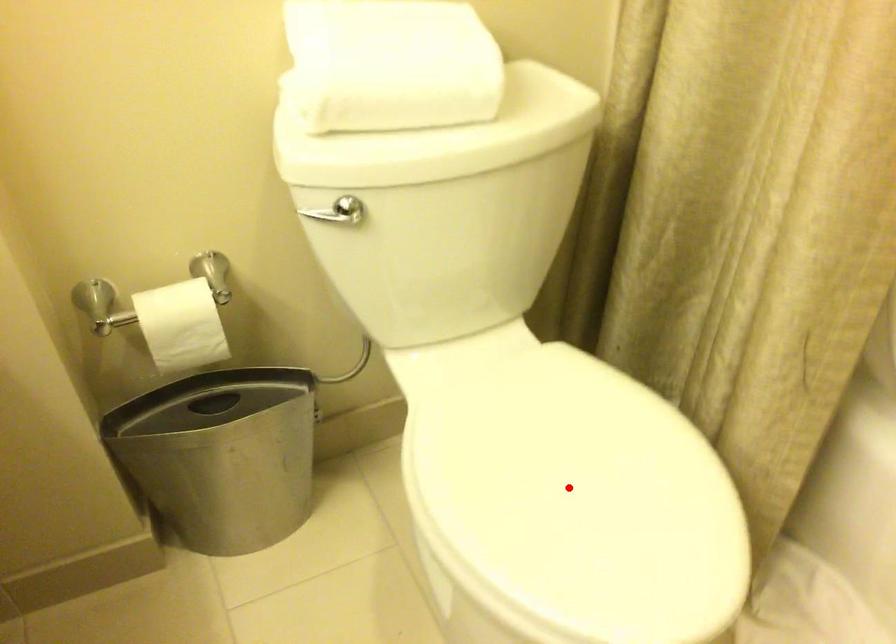
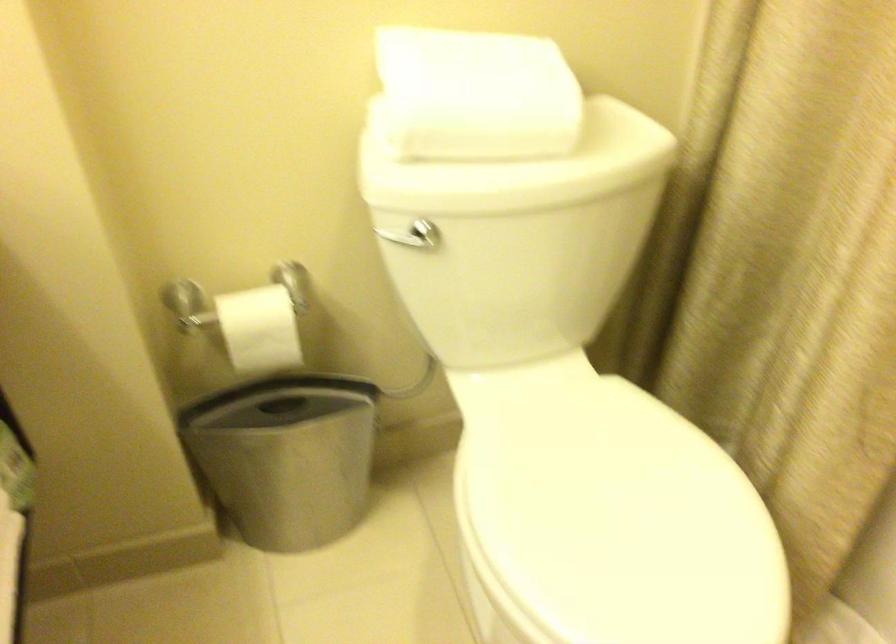
The point at the highlighted location is marked in the first image. Where is the corresponding point in the second image?

(613, 518)